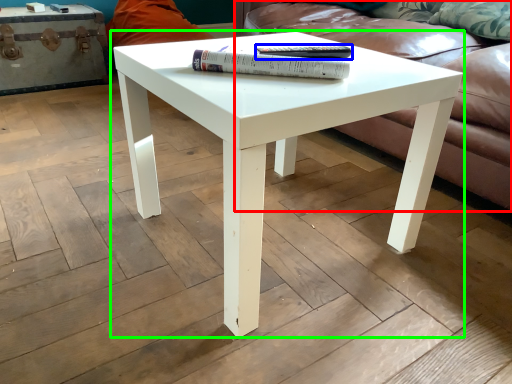
Question: Based on their relative distances, which object is nearer to studio couch (highlighted by a red box)? Choose from paperback book (highlighted by a blue box) and coffee table (highlighted by a green box).

Choices:
 (A) paperback book
 (B) coffee table

Answer: (B)